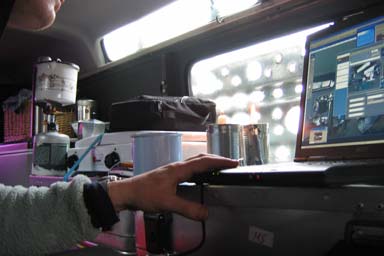
Image resolution: width=384 pixels, height=256 pixels. What are the coordinates of `screen` in the screenshot? It's located at (345, 109).